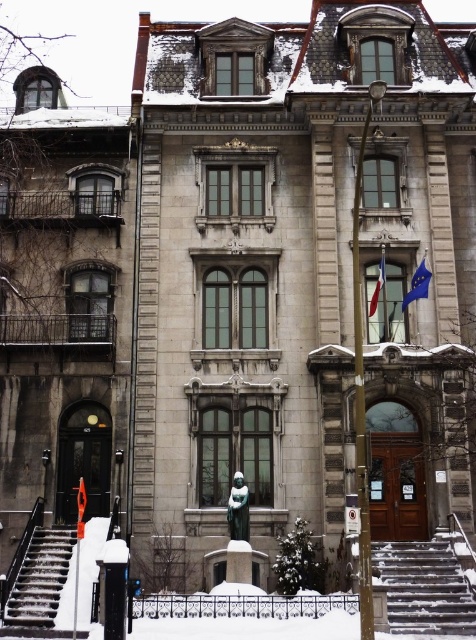
You are standing at the base of the smooth concrete stairs at lower left and want to reach the blue fabric flag at upper right. Which direction should you move to get closer to the flag?

To reach the blue fabric flag at upper right, you should move upward since the smooth concrete stairs at lower left is positioned under the flag.